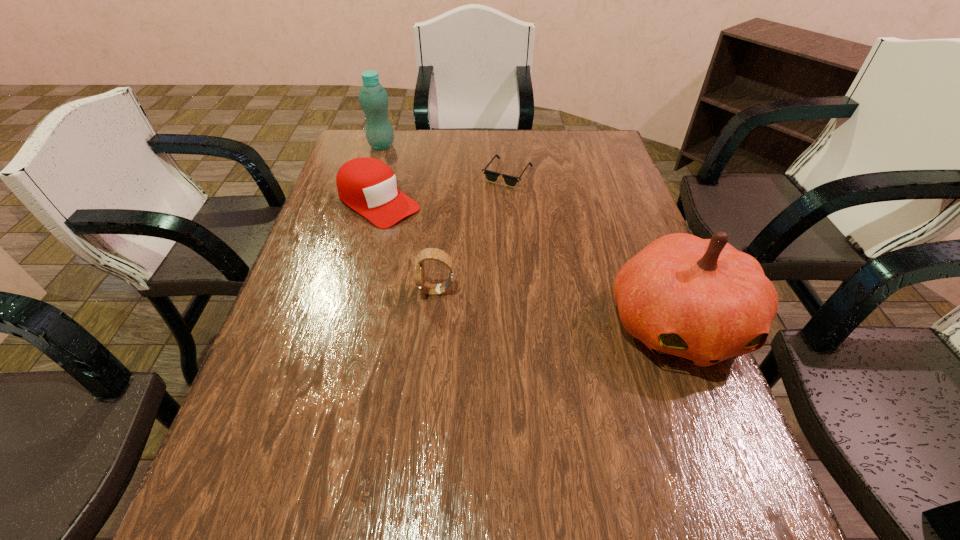
You are a GUI agent. You are given a task and a screenshot of the screen. Output one action in this format:
    pyautogui.click(x=<x>, y=<y>)
    Task: Click on the water bottle that is positioned at the far edge
    This screenshot has height=540, width=960.
    Given the screenshot: What is the action you would take?
    pyautogui.click(x=373, y=98)

This screenshot has width=960, height=540. What are the coordinates of `water bottle that is at the left edge` in the screenshot? It's located at (373, 98).

The image size is (960, 540). Find the location of `baseball cap that is positioned at the left edge`. baseball cap that is positioned at the left edge is located at coordinates (367, 185).

The height and width of the screenshot is (540, 960). Find the location of `object that is at the right edge`. object that is at the right edge is located at coordinates (700, 300).

This screenshot has height=540, width=960. In order to click on object present at the far left corner in this screenshot , I will do `click(373, 98)`.

Locate an element on the screen. The height and width of the screenshot is (540, 960). free space at the far edge is located at coordinates (444, 165).

In the image, there is a desktop. Identify the location of vacant space at the near edge. click(x=618, y=437).

In the image, there is a desktop. Where is `free region at the left edge`? free region at the left edge is located at coordinates (323, 257).

At what (x,y) coordinates should I click in order to perform the action: click on vacant region at the right edge. Please return your answer as a coordinate pair (x, y). This screenshot has width=960, height=540. Looking at the image, I should click on (606, 234).

The height and width of the screenshot is (540, 960). I want to click on vacant space at the near left corner of the desktop, so tap(248, 432).